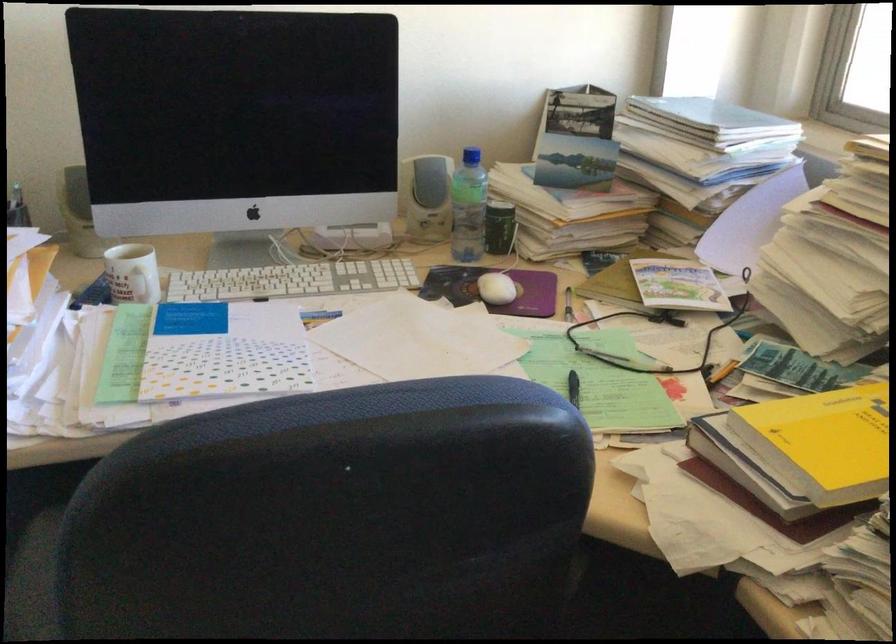
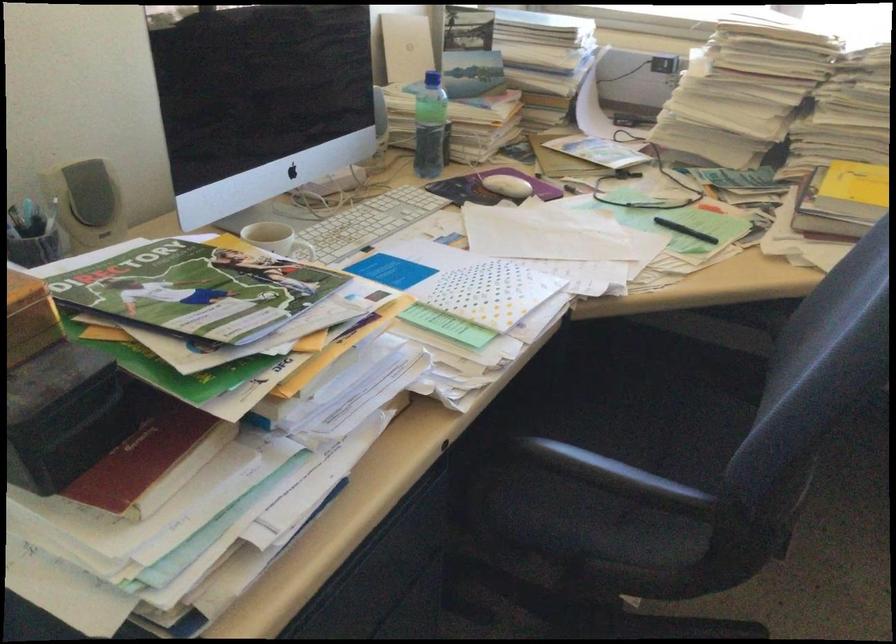
Locate, in the second image, the point that corresponds to point (791, 428) in the first image.

(853, 194)